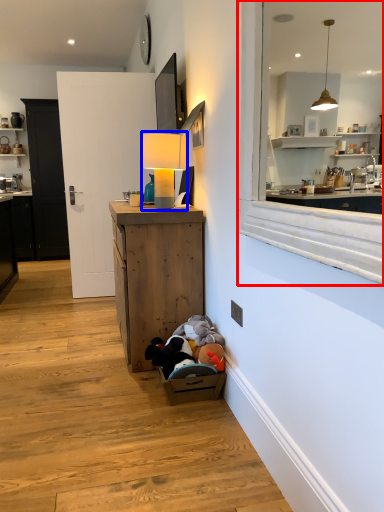
Question: Which object appears closest to the camera in this image, window (highlighted by a red box) or table lamp (highlighted by a blue box)?

Choices:
 (A) window
 (B) table lamp

Answer: (A)